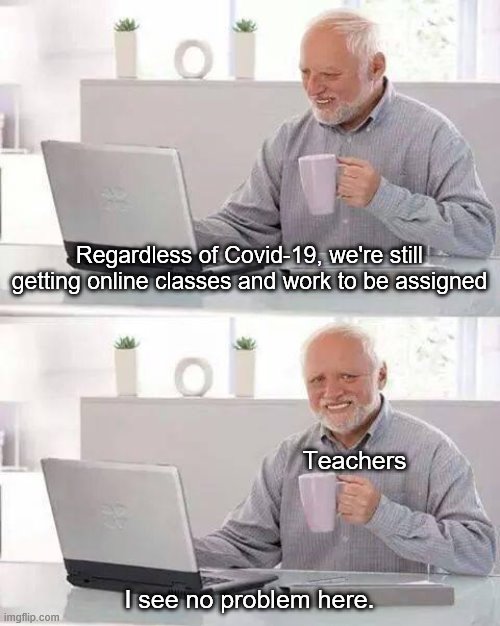
Locate an element on the screen. The image size is (500, 626). inside of circle decoration is located at coordinates (191, 58), (194, 377).